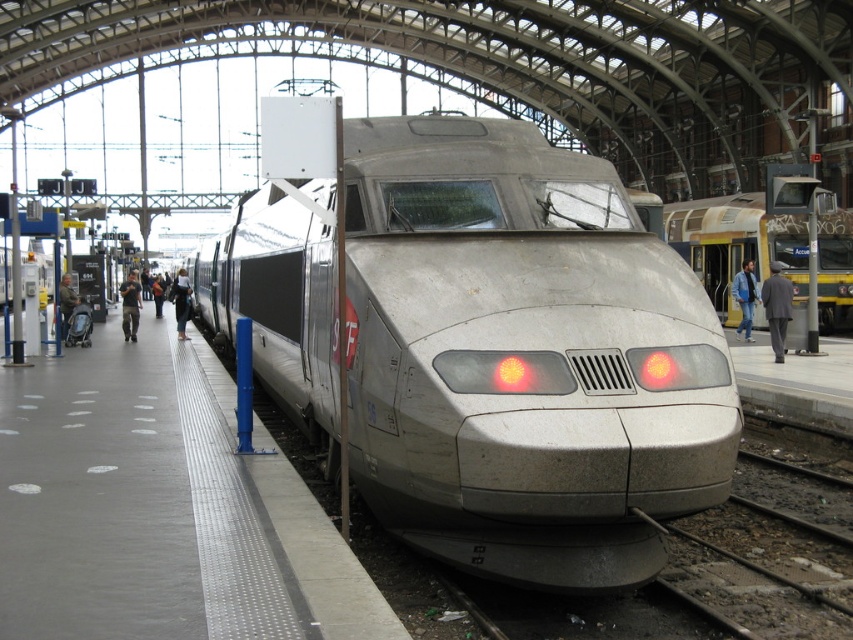
In the scene shown: You are a maintenance worker who needs to reach the silver metallic train at center from your current position near the dark gray suit at left. The safety regulations state that you must stay within 10 meters of the train at all times. Can you safely approach the train without violating the regulations?

The silver metallic train at center and dark gray suit at left are 9.85 meters apart from each other. Since the distance is less than 10 meters, you can safely approach the train without violating the safety regulations.

You are standing at the platform and want to take a photo of the train. You notice two points marked on the platform floor, one at point (509, 513) and the other at point (181, 540). Which point is closer to you when you are facing the train?

Point (509, 513) is closer to the camera than point (181, 540), so the point at (509, 513) is closer to you when facing the train.